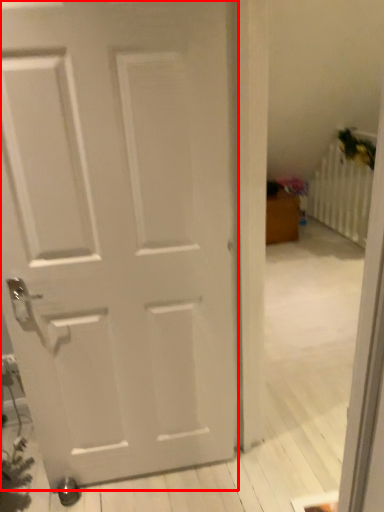
Question: From the image's perspective, where is door (annotated by the red box) located relative to radiator?

Choices:
 (A) below
 (B) above

Answer: (A)